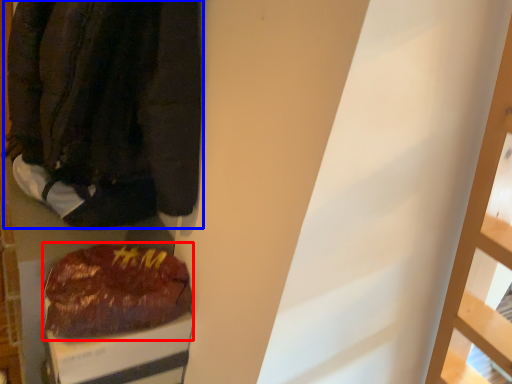
Question: Which of the following is the farthest to the observer, food (highlighted by a red box) or jacket (highlighted by a blue box)?

Choices:
 (A) food
 (B) jacket

Answer: (A)